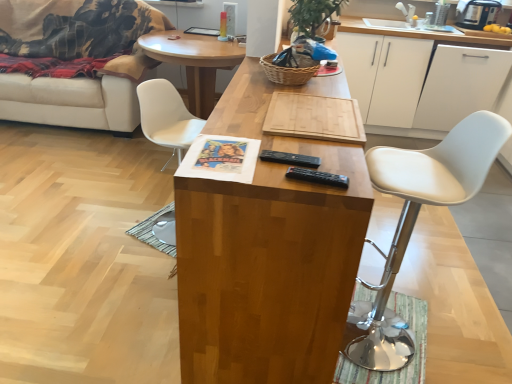
This screenshot has height=384, width=512. I want to click on free space in front of woven brown basket at center, so point(275,90).